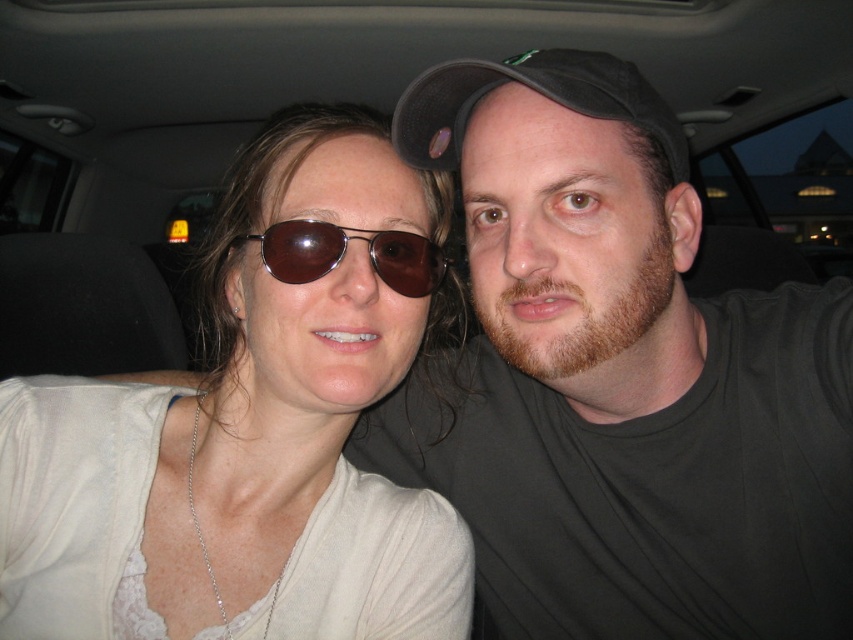
You are a photographer trying to capture a clear photo of both the black fabric baseball cap at upper center and the brown reflective sunglasses at center inside the car. Since the camera can only focus on one object at a time, which object should you choose to ensure the other is still recognizable in the photo?

The black fabric baseball cap at upper center is larger than the brown reflective sunglasses at center, so focusing on the larger object will ensure the smaller one is still recognizable.

You are a passenger in a car and want to hand a document to the person wearing the matte white shirt at left. Based on the coordinates provided, where exactly should you reach to give them the document?

The matte white shirt at left is located at coordinates point [250,429], so you should reach towards that position to hand the document to the person wearing the matte white shirt at left.

You are a photographer trying to capture a clear photo of both the matte white shirt at left and the brown reflective sunglasses at center. Since the car interior is dimly lit, you need to adjust your camera settings. Which object should you focus on first to ensure both are in sharp focus?

The matte white shirt at left is closer to the viewer than the brown reflective sunglasses at center. To ensure both are in sharp focus, focus on the matte white shirt at left first, as it is closer, and use a smaller aperture or adjust the depth of field to include the brown reflective sunglasses at center.